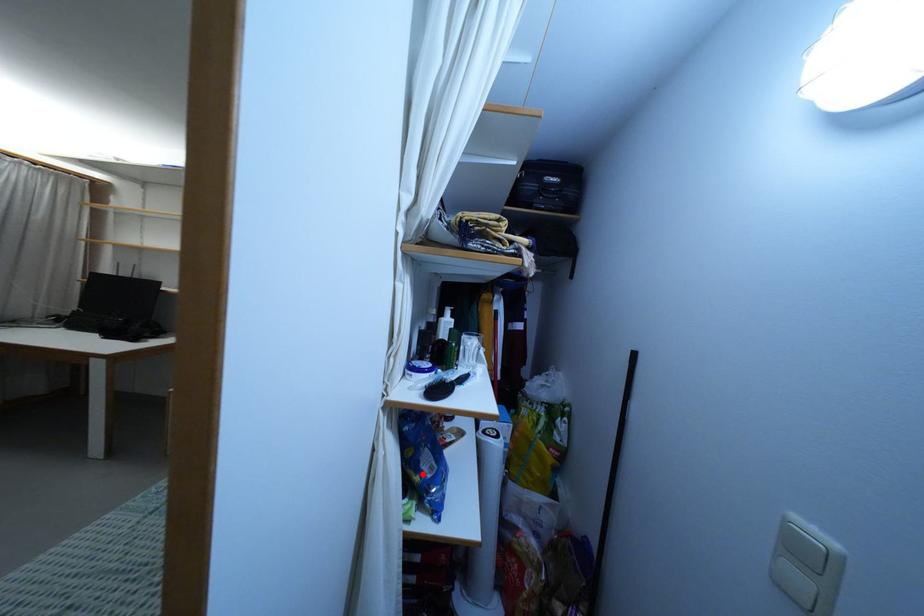
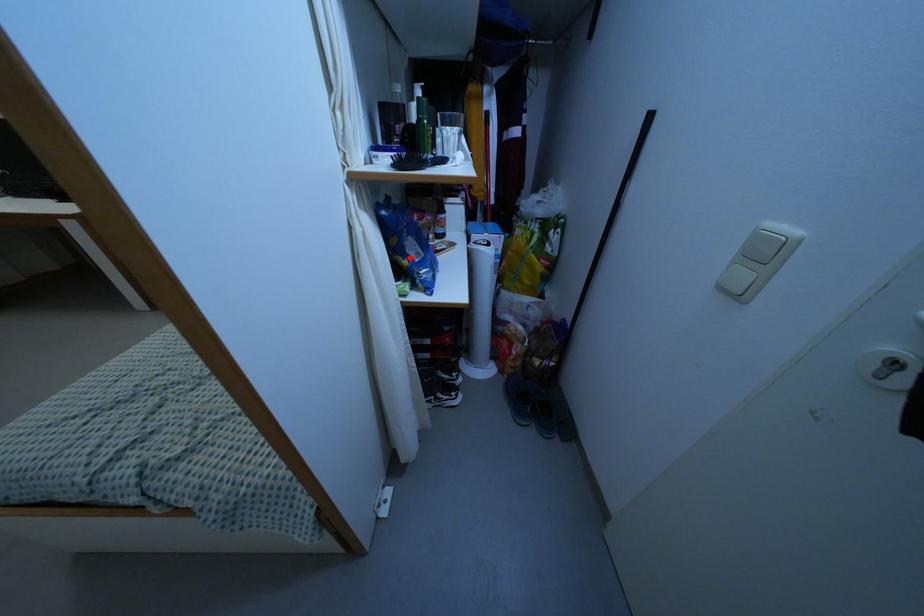
I am providing you with two images of the same scene from different viewpoints. A red point is marked on the first image and another point is marked on the second image. Are the points marked in image1 and image2 representing the same 3D position?

Yes